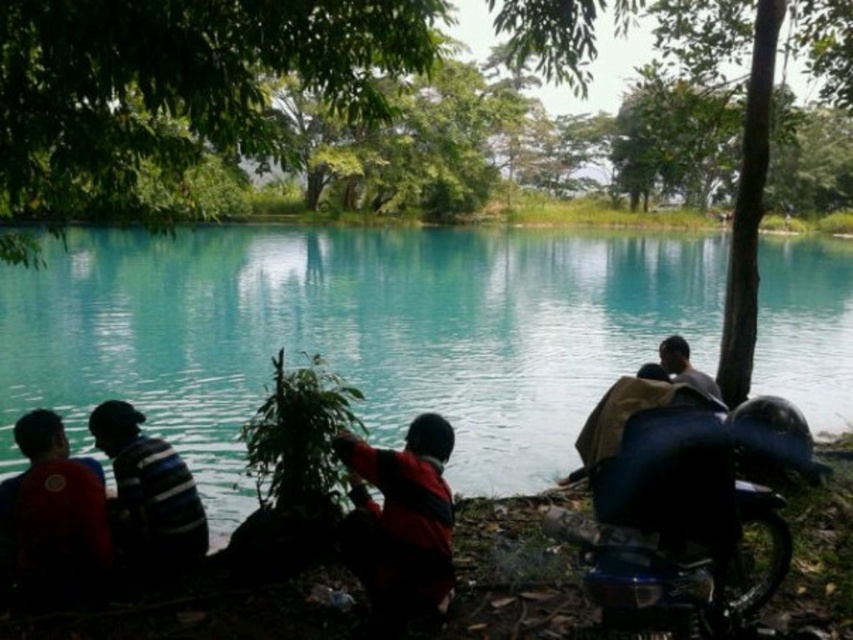
You are standing at the edge of the water in the scene. There are two points marked in the image. One is at coordinates point (100, 416) and the other is at point (700, 372). Which point is nearer to you?

Point (100, 416) is closer to the viewer than point (700, 372).

You are a photographer trying to capture a clear shot of the shiny black motorcycle at lower right. However, the green leafy tree at center is blocking your view. Based on their sizes, can you suggest a way to adjust your position to get an unobstructed view?

The green leafy tree at center is taller than the shiny black motorcycle at lower right. To get an unobstructed view of the shiny black motorcycle at lower right, move to a position where the tree is no longer in front of the motorcycle. Since the tree is taller, moving to a lower elevation or shifting sideways might help you avoid the obstruction caused by the tree.